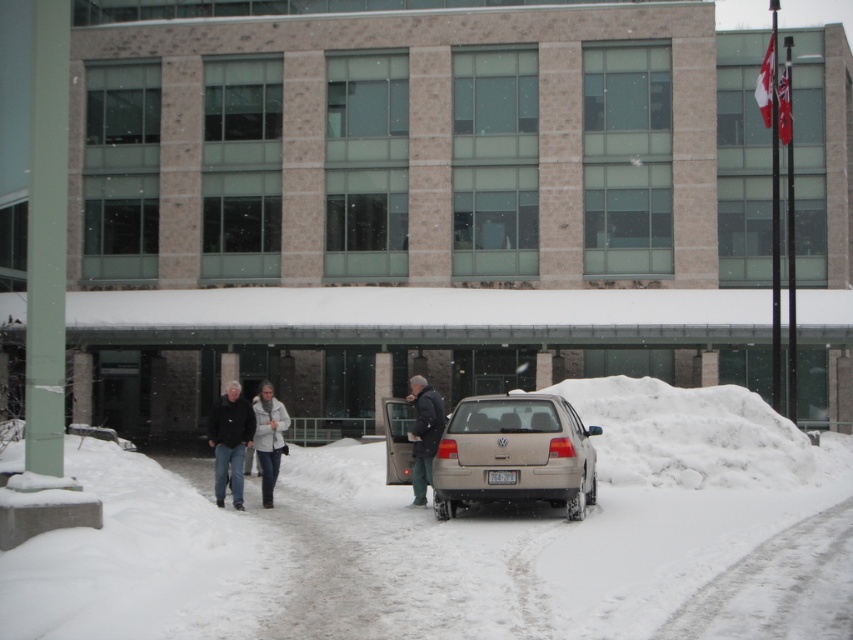
Looking at this image, you are a delivery person who needs to load a large package into the trunk of the satin beige sedan at center. The package is 1.5 meters long. The dark blue jeans at center are lying on the ground. Can the package fit in the trunk if the jeans are moved?

The satin beige sedan at center is bigger than dark blue jeans at center, but the size of the trunk isn not specified. The presence of the jeans might not affect the trunk space since they are on the ground. Without knowing the trunk dimensions, it is impossible to determine if the 1.5 meter package will fit.